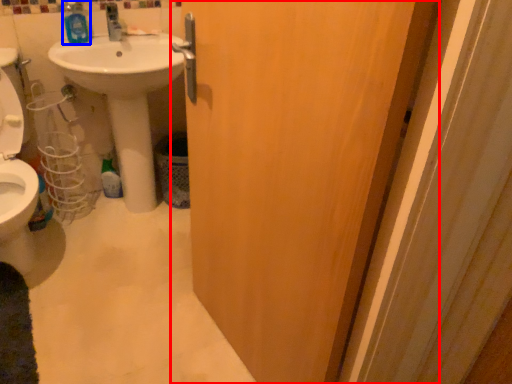
Question: Which of the following is the closest to the observer, door (highlighted by a red box) or mouthwash (highlighted by a blue box)?

Choices:
 (A) door
 (B) mouthwash

Answer: (A)